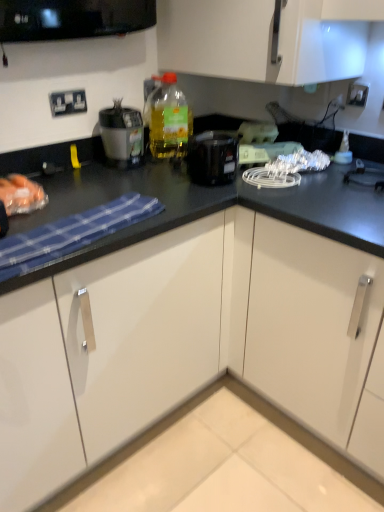
Question: Can white plastic electrical outlet at upper left, arranged as the second electric outlet when viewed from the right, be found inside black plastic coffee maker at center?

Choices:
 (A) yes
 (B) no

Answer: (B)

Question: From a real-world perspective, is black plastic coffee maker at center located higher than white plastic electrical outlet at upper left, arranged as the second electric outlet when viewed from the right?

Choices:
 (A) no
 (B) yes

Answer: (A)

Question: Considering the relative sizes of black plastic coffee maker at center and white plastic electrical outlet at upper left, arranged as the second electric outlet when viewed from the right, in the image provided, is black plastic coffee maker at center thinner than white plastic electrical outlet at upper left, arranged as the second electric outlet when viewed from the right,?

Choices:
 (A) yes
 (B) no

Answer: (B)

Question: Is the position of black plastic coffee maker at center more distant than that of white plastic electrical outlet at upper left, arranged as the second electric outlet when viewed from the right?

Choices:
 (A) yes
 (B) no

Answer: (B)

Question: Is black plastic coffee maker at center bigger than white plastic electrical outlet at upper left, which is the 1th electric outlet from left to right?

Choices:
 (A) yes
 (B) no

Answer: (A)

Question: From the image's perspective, is black plastic coffee maker at center above or below white glossy cabinet at lower center?

Choices:
 (A) below
 (B) above

Answer: (B)

Question: Would you say black plastic coffee maker at center is to the left or to the right of white glossy cabinet at lower center in the picture?

Choices:
 (A) right
 (B) left

Answer: (A)

Question: Choose the correct answer: Is black plastic coffee maker at center inside white glossy cabinet at lower center or outside it?

Choices:
 (A) inside
 (B) outside

Answer: (B)

Question: Is black plastic coffee maker at center bigger or smaller than white glossy cabinet at lower center?

Choices:
 (A) small
 (B) big

Answer: (A)

Question: Considering their positions, is white glossy cabinet at lower center located in front of or behind translucent plastic bottle at upper center?

Choices:
 (A) front
 (B) behind

Answer: (A)

Question: From the image's perspective, is white glossy cabinet at lower center located above or below translucent plastic bottle at upper center?

Choices:
 (A) above
 (B) below

Answer: (B)

Question: Looking at the image, does white glossy cabinet at lower center seem bigger or smaller compared to translucent plastic bottle at upper center?

Choices:
 (A) big
 (B) small

Answer: (A)

Question: In terms of width, does white glossy cabinet at lower center look wider or thinner when compared to translucent plastic bottle at upper center?

Choices:
 (A) thin
 (B) wide

Answer: (B)

Question: Which is correct: white plastic electric outlet at upper right, the 1th electric outlet viewed from the right, is inside black plastic coffee maker at center, or outside of it?

Choices:
 (A) outside
 (B) inside

Answer: (A)

Question: Is point (365, 94) positioned closer to the camera than point (220, 157)?

Choices:
 (A) farther
 (B) closer

Answer: (A)